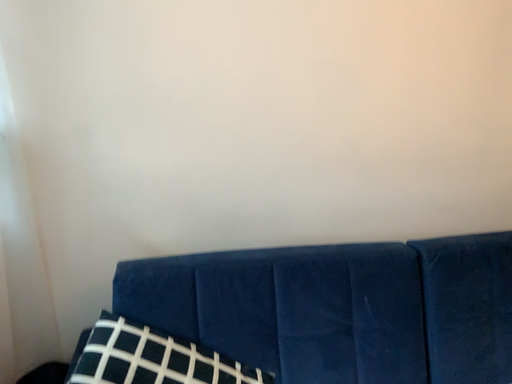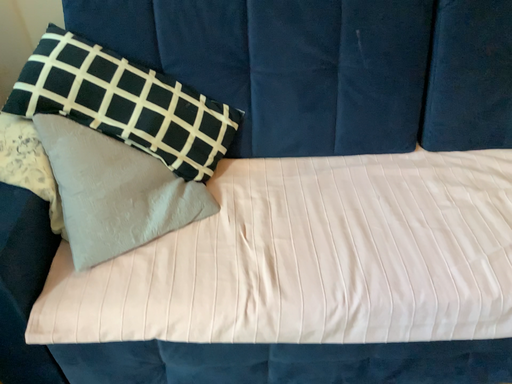
Question: Which way did the camera rotate in the video?

Choices:
 (A) rotated right
 (B) rotated left

Answer: (B)